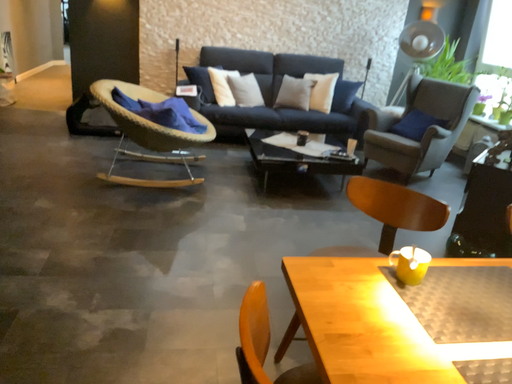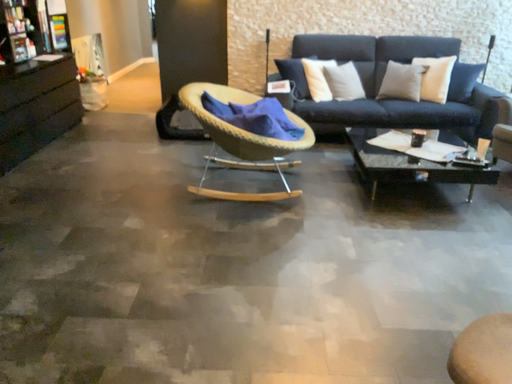
Question: How did the camera likely rotate when shooting the video?

Choices:
 (A) rotated left
 (B) rotated right

Answer: (A)